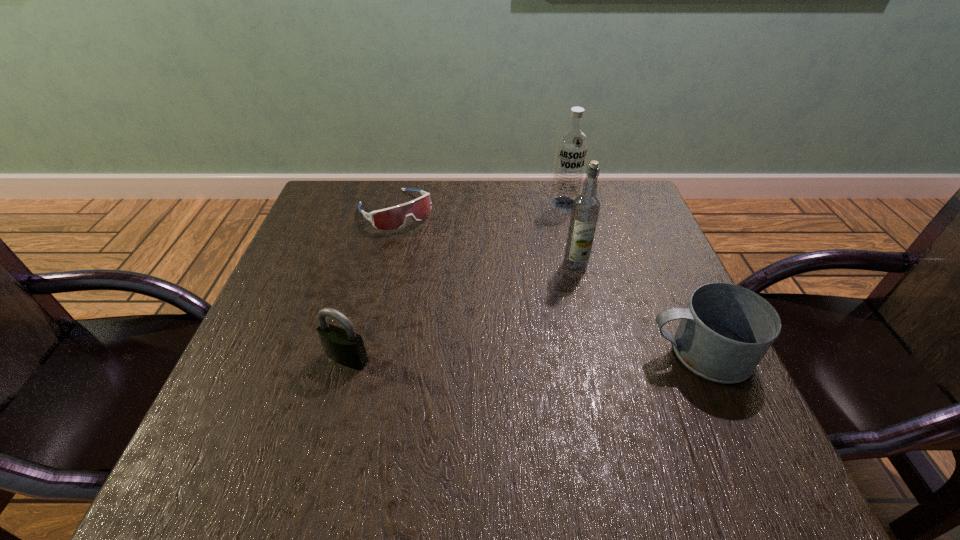
Find the location of `padlock`. padlock is located at coordinates (344, 346).

The height and width of the screenshot is (540, 960). I want to click on mug, so click(x=725, y=330).

Where is `goggles`? goggles is located at coordinates (395, 217).

Identify the location of the farther vodka. (572, 145).

Locate an element on the screen. This screenshot has height=540, width=960. the third nearest object is located at coordinates (586, 207).

In order to click on blank space located 0.260m on the back of the padlock in this screenshot , I will do `click(373, 259)`.

Where is `free region located on the side of the rightmost object with the handle`? This screenshot has height=540, width=960. free region located on the side of the rightmost object with the handle is located at coordinates (610, 352).

At what (x,y) coordinates should I click in order to perform the action: click on free location located on the side of the rightmost object with the handle. Please return your answer as a coordinate pair (x, y). The image size is (960, 540). Looking at the image, I should click on (x=473, y=352).

At what (x,y) coordinates should I click in order to perform the action: click on free location located 0.090m on the side of the rightmost object with the handle. Please return your answer as a coordinate pair (x, y). The width and height of the screenshot is (960, 540). Looking at the image, I should click on (599, 352).

In order to click on vacant space located 0.280m on the front-facing side of the shortest object in this screenshot , I will do `click(470, 295)`.